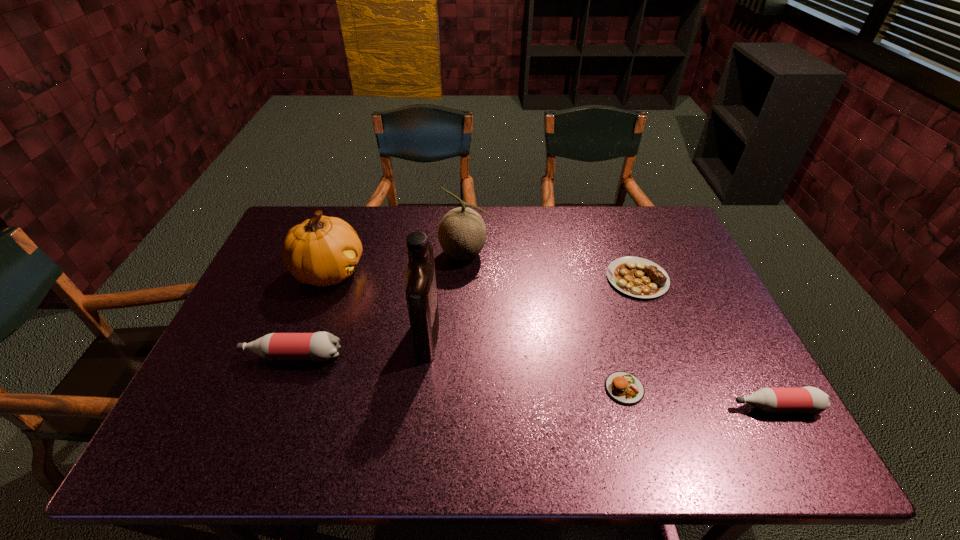
In the image, there is a desktop. At what (x,y) coordinates should I click in order to perform the action: click on free space at the near left corner. Please return your answer as a coordinate pair (x, y). This screenshot has width=960, height=540. Looking at the image, I should click on (256, 402).

In the image, there is a desktop. At what (x,y) coordinates should I click in order to perform the action: click on vacant space at the far right corner. Please return your answer as a coordinate pair (x, y). The image size is (960, 540). Looking at the image, I should click on (639, 240).

Locate an element on the screen. This screenshot has width=960, height=540. vacant area that lies between the taller bottle and the steak is located at coordinates (465, 317).

Locate an element on the screen. free space between the nearer bottle and the pumpkin is located at coordinates (552, 339).

You are a GUI agent. You are given a task and a screenshot of the screen. Output one action in this format:
    pyautogui.click(x=<x>, y=<y>)
    Task: Click on the vacant space that's between the cantaloup and the pumpkin
    
    Given the screenshot: What is the action you would take?
    pyautogui.click(x=397, y=263)

Where is `free point between the steak and the pumpkin`? free point between the steak and the pumpkin is located at coordinates (483, 275).

The image size is (960, 540). In order to click on unoccupied area between the right bottle and the fourth shortest object in this screenshot , I will do `click(534, 381)`.

The width and height of the screenshot is (960, 540). Identify the location of free spot between the cantaloup and the pumpkin. (397, 263).

The image size is (960, 540). I want to click on vacant space in between the patty and the taller bottle, so click(x=458, y=372).

The height and width of the screenshot is (540, 960). I want to click on free point between the pumpkin and the patty, so click(477, 330).